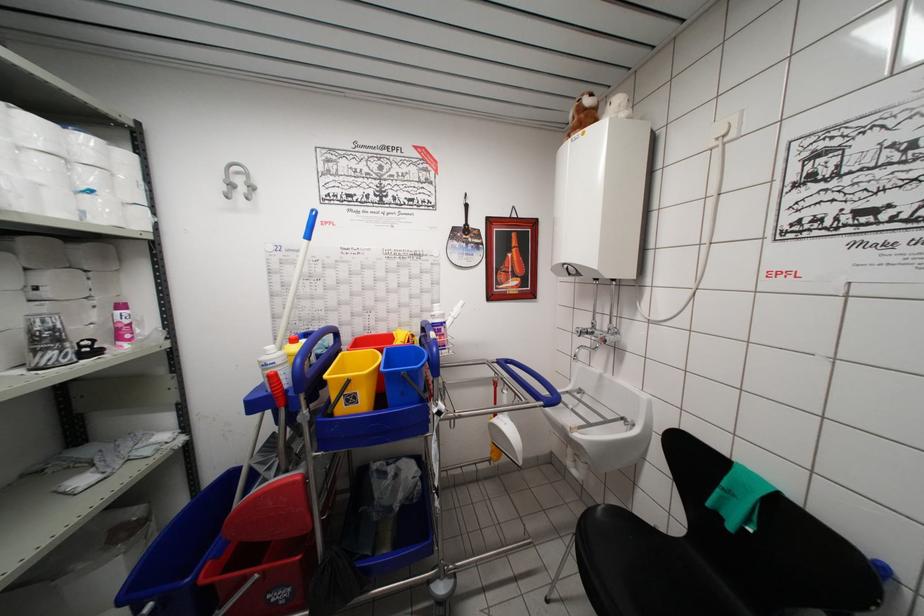
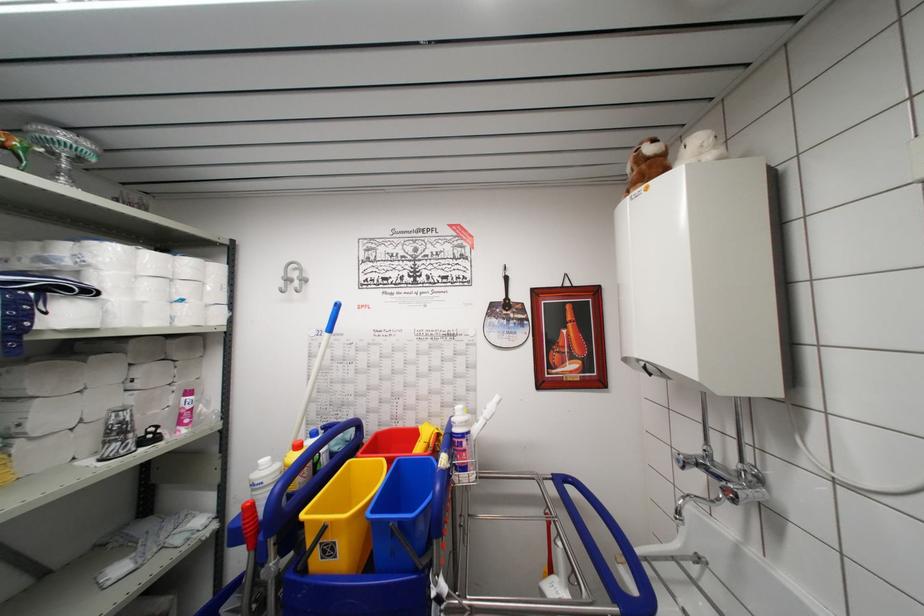
Question: How did the camera likely rotate?

Choices:
 (A) Left
 (B) Right
 (C) Up
 (D) Down

Answer: (A)